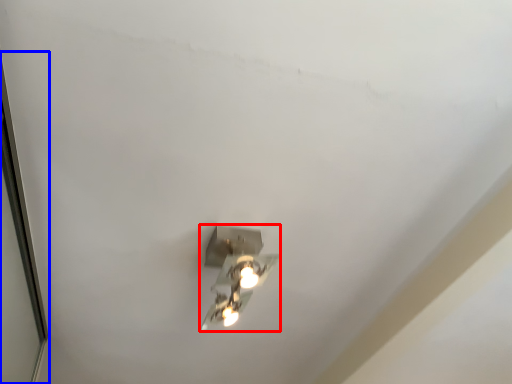
Question: Which point is further to the camera, lamp (highlighted by a red box) or glass door (highlighted by a blue box)?

Choices:
 (A) lamp
 (B) glass door

Answer: (A)